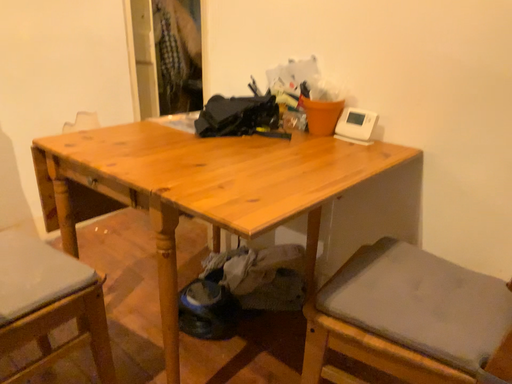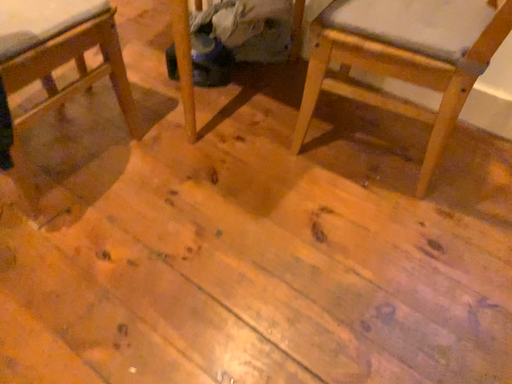
Question: How did the camera likely rotate when shooting the video?

Choices:
 (A) rotated downward
 (B) rotated upward

Answer: (A)